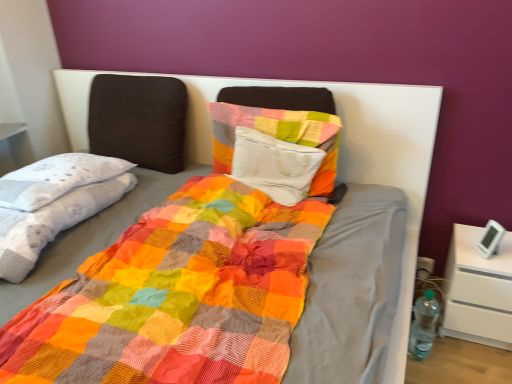
Where is `empty space that is ontop of white matte nightstand at lower right (from a real-world perspective)`? The height and width of the screenshot is (384, 512). empty space that is ontop of white matte nightstand at lower right (from a real-world perspective) is located at coordinates (485, 244).